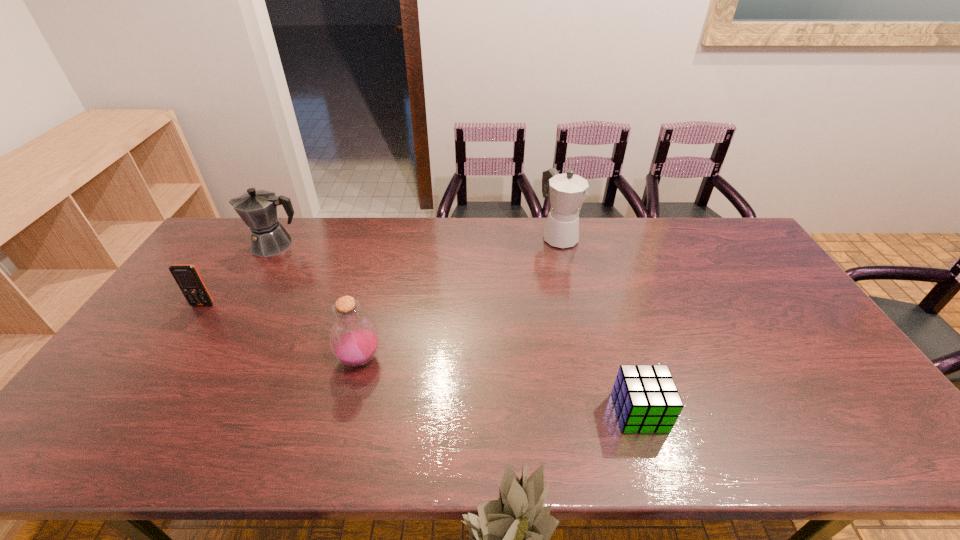
The height and width of the screenshot is (540, 960). Find the location of `vacant space that satisfies the following two spatial constraints: 1. at the spout of the cube; 2. on the right side of the left coffeepot`. vacant space that satisfies the following two spatial constraints: 1. at the spout of the cube; 2. on the right side of the left coffeepot is located at coordinates (177, 413).

Identify the location of vacant space that satisfies the following two spatial constraints: 1. at the spout of the left coffeepot; 2. on the left side of the bottle. This screenshot has width=960, height=540. (208, 359).